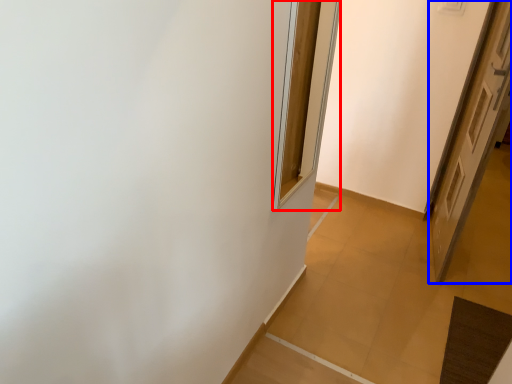
Question: Which object is closer to the camera taking this photo, window (highlighted by a red box) or door (highlighted by a blue box)?

Choices:
 (A) window
 (B) door

Answer: (A)